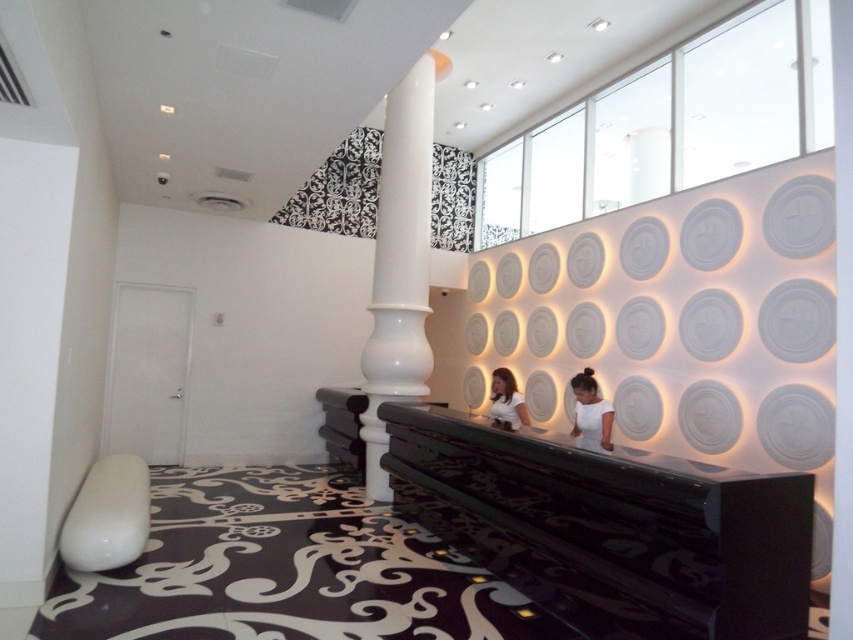
You are standing at the camera position in the reception area. There is a point marked at coordinates point (403, 296). Can you reach that point without moving past it? Please explain your reasoning.

The distance between you and point (403, 296) is 5.70 meters. Since you can move forward up to that point, you can reach it without moving past it.

You are standing in the reception area and want to move from the black glossy balustrade at center to the white glossy column at center. Which direction should you move to get closer to the column?

The black glossy balustrade at center is closer to the viewer than the white glossy column at center, so you should move backward to get closer to the white glossy column at center.

You are a visitor in this reception area and want to know which object at the center is taller between the white glossy column at center and the white matte shirt at center. Can you help me?

The white glossy column at center is much taller than the white matte shirt at center.